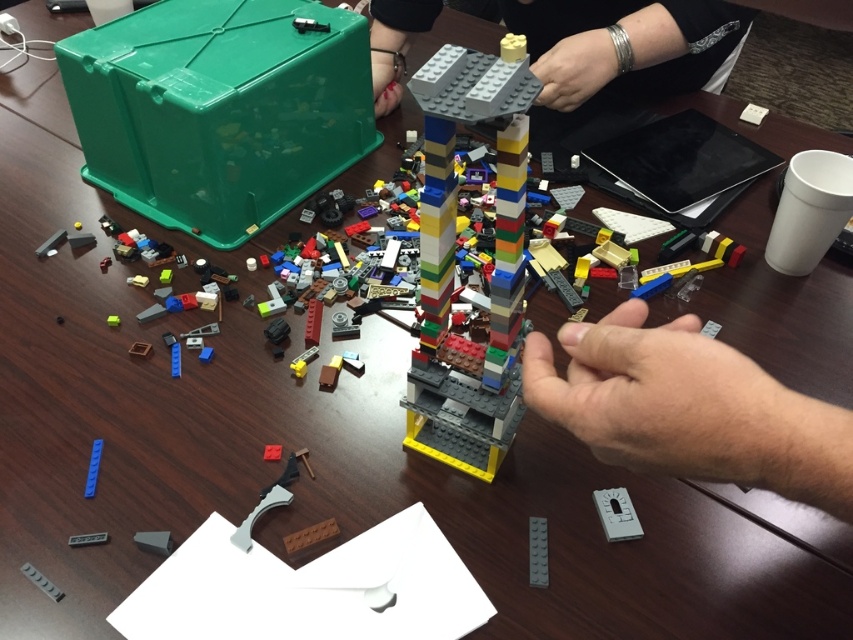
Which is in front, point (445, 141) or point (621, 51)?

Point (445, 141)

Who is higher up, multicolored plastic tower at center or smooth gray lego piece at upper center?

smooth gray lego piece at upper center

Is point (489, 113) farther from viewer compared to point (552, 17)?

That is False.

Where is `multicolored plastic tower at center`? This screenshot has width=853, height=640. multicolored plastic tower at center is located at coordinates (453, 260).

Is smooth gray hand at center wider than smooth gray lego piece at upper center?

No, smooth gray hand at center is not wider than smooth gray lego piece at upper center.

Does smooth gray hand at center appear on the left side of smooth gray lego piece at upper center?

Indeed, smooth gray hand at center is positioned on the left side of smooth gray lego piece at upper center.

The image size is (853, 640). Identify the location of smooth gray hand at center. (689, 408).

Can you confirm if smooth gray hand at center is positioned below multicolored plastic tower at center?

Yes, smooth gray hand at center is below multicolored plastic tower at center.

Between point (608, 412) and point (498, 356), which one is positioned behind?

Point (498, 356)

Where is `smooth gray hand at center`? smooth gray hand at center is located at coordinates (689, 408).